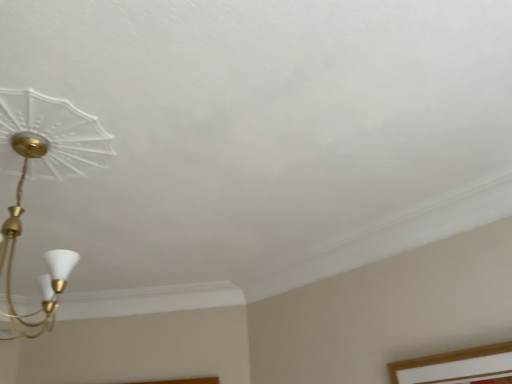
You are a GUI agent. You are given a task and a screenshot of the screen. Output one action in this format:
    pyautogui.click(x=<x>, y=<y>)
    Task: Click on the matte gold chandelier at upper left
    Image resolution: width=512 pixels, height=384 pixels.
    Given the screenshot: What is the action you would take?
    pyautogui.click(x=44, y=178)

Describe the element at coordinates (44, 178) in the screenshot. I see `matte gold chandelier at upper left` at that location.

The width and height of the screenshot is (512, 384). I want to click on matte gold chandelier at upper left, so click(x=44, y=178).